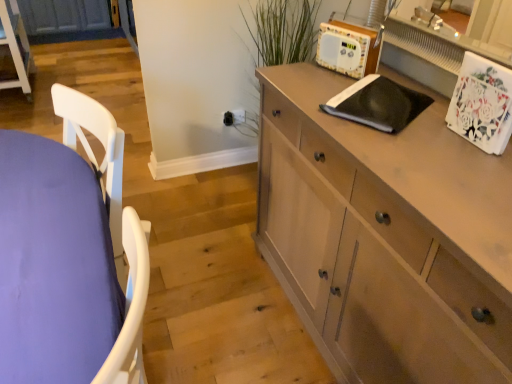
Question: Is light brown wood cabinet at right in front of or behind purple fabric table at left in the image?

Choices:
 (A) front
 (B) behind

Answer: (A)

Question: Is light brown wood cabinet at right inside or outside of purple fabric table at left?

Choices:
 (A) outside
 (B) inside

Answer: (A)

Question: Estimate the real-world distances between objects in this image. Which object is farther from the wooden radio at upper right?

Choices:
 (A) purple fabric table at left
 (B) green matte plant at upper center
 (C) light brown wood cabinet at right
 (D) light brown wood cabinet at lower left

Answer: (D)

Question: Which object is positioned farthest from the light brown wood cabinet at right?

Choices:
 (A) light brown wood cabinet at lower left
 (B) green matte plant at upper center
 (C) purple fabric table at left
 (D) wooden radio at upper right

Answer: (A)